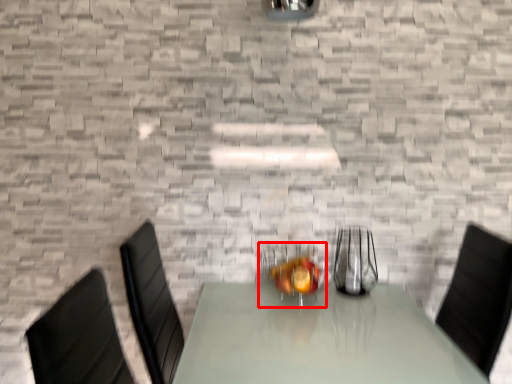
Question: From the image's perspective, considering the relative positions of tableware (annotated by the red box) and tableware in the image provided, where is tableware (annotated by the red box) located with respect to the staircase?

Choices:
 (A) below
 (B) above

Answer: (A)